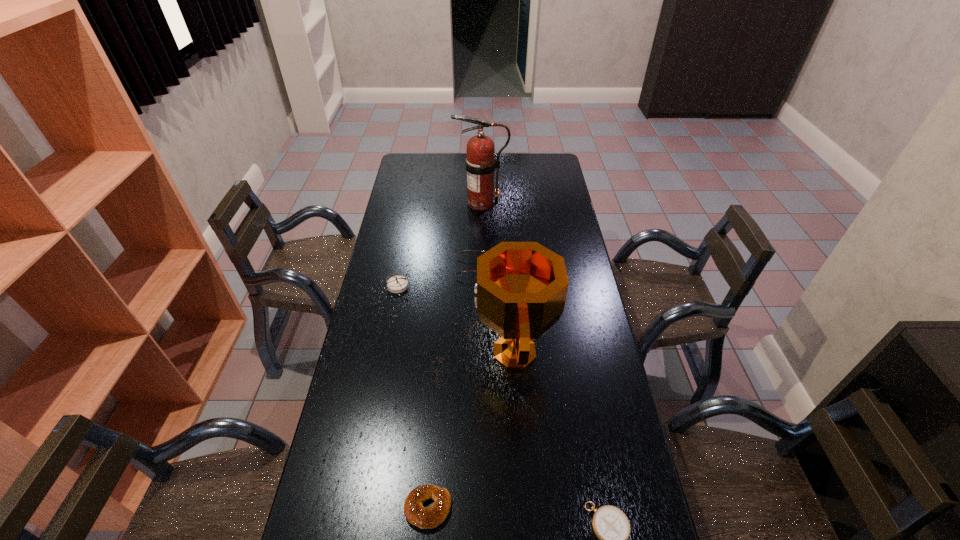
Identify the location of free space between the left compass and the spectacles. (434, 276).

Where is `empty space between the second shortest object and the farthest object`? The height and width of the screenshot is (540, 960). empty space between the second shortest object and the farthest object is located at coordinates (454, 355).

At what (x,y) coordinates should I click in order to perform the action: click on free spot between the fourth farthest object and the third farthest object. Please return your answer as a coordinate pair (x, y). Looking at the image, I should click on (455, 319).

You are a GUI agent. You are given a task and a screenshot of the screen. Output one action in this format:
    pyautogui.click(x=<x>, y=<y>)
    Task: Click on the vacant space that's between the fire extinguisher and the bagel
    
    Given the screenshot: What is the action you would take?
    pyautogui.click(x=454, y=355)

Identify the location of free space between the farther compass and the fire extinguisher. (439, 244).

Identify the location of free space between the fire extinguisher and the fifth tallest object. The width and height of the screenshot is (960, 540). (454, 355).

The width and height of the screenshot is (960, 540). In order to click on object that is the fourth closest to the right compass in this screenshot , I will do `click(396, 284)`.

Identify which object is the third nearest to the fire extinguisher. Please provide its 2D coordinates. Your answer should be formatted as a tuple, i.e. [(x, y)], where the tuple contains the x and y coordinates of a point satisfying the conditions above.

[(521, 289)]

Where is `vacant space that satisfies the following two spatial constraints: 1. on the side of the award with the star emblem; 2. on the front side of the bagel`? Image resolution: width=960 pixels, height=540 pixels. vacant space that satisfies the following two spatial constraints: 1. on the side of the award with the star emblem; 2. on the front side of the bagel is located at coordinates (523, 508).

Identify the location of free point that satisfies the following two spatial constraints: 1. on the front side of the taller compass; 2. on the left side of the bagel. (355, 508).